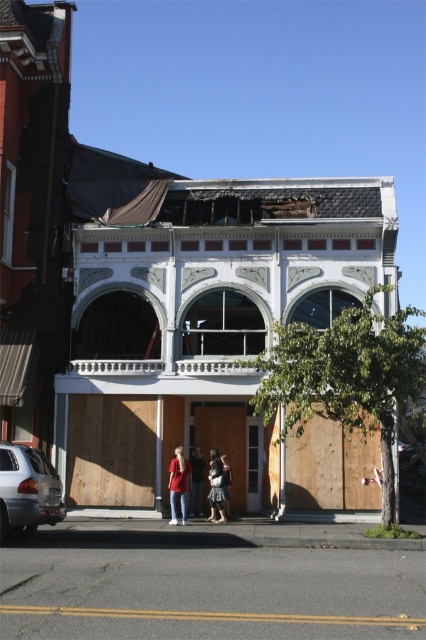
Consider the image. Is denim skirt at center thinner than light brown leather jacket at center?

In fact, denim skirt at center might be wider than light brown leather jacket at center.

Does denim skirt at center appear on the left side of light brown leather jacket at center?

Indeed, denim skirt at center is positioned on the left side of light brown leather jacket at center.

Where is `denim skirt at center`? Image resolution: width=426 pixels, height=640 pixels. denim skirt at center is located at coordinates tap(215, 486).

Who is positioned more to the left, denim pants at lower center or denim skirt at center?

denim pants at lower center

From the picture: Is denim pants at lower center positioned before denim skirt at center?

Yes, it is.

Identify the location of denim pants at lower center. The width and height of the screenshot is (426, 640). (178, 484).

Which is above, denim skirt at center or matte red shirt at center?

denim skirt at center is above.

Which is in front, point (219, 516) or point (192, 506)?

Point (219, 516) is in front.

This screenshot has height=640, width=426. Find the location of `denim skirt at center`. denim skirt at center is located at coordinates (215, 486).

Find the location of a particular element. denim skirt at center is located at coordinates (215, 486).